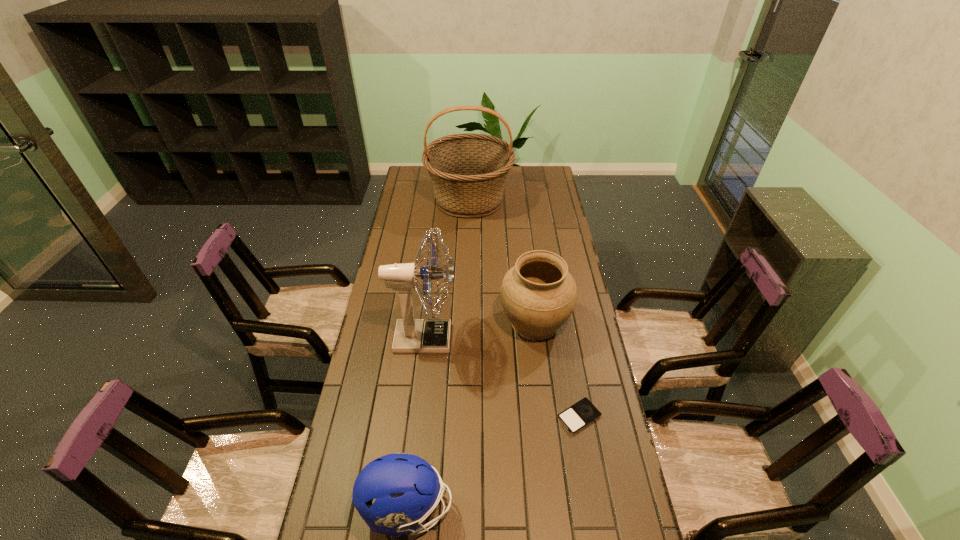
Where is `free point between the fan and the third shortest object`? This screenshot has width=960, height=540. free point between the fan and the third shortest object is located at coordinates (480, 330).

The width and height of the screenshot is (960, 540). I want to click on free area in between the fan and the fourth farthest object, so point(502,377).

Choose which object is the nearest neighbor to the fan. Please provide its 2D coordinates. Your answer should be formatted as a tuple, i.e. [(x, y)], where the tuple contains the x and y coordinates of a point satisfying the conditions above.

[(538, 294)]

Identify which object is located as the second nearest to the farthest object. Please provide its 2D coordinates. Your answer should be formatted as a tuple, i.e. [(x, y)], where the tuple contains the x and y coordinates of a point satisfying the conditions above.

[(412, 335)]

Identify the location of blank space that satisfies the following two spatial constraints: 1. on the front-facing side of the fan; 2. on the left side of the shortest object. (416, 417).

The width and height of the screenshot is (960, 540). I want to click on vacant space that satisfies the following two spatial constraints: 1. on the front-facing side of the fourth farthest object; 2. on the left side of the fan, so click(x=416, y=417).

The width and height of the screenshot is (960, 540). In order to click on vacant space that satisfies the following two spatial constraints: 1. on the front-facing side of the fan; 2. on the left side of the fourth farthest object in this screenshot , I will do `click(416, 417)`.

You are a GUI agent. You are given a task and a screenshot of the screen. Output one action in this format:
    pyautogui.click(x=<x>, y=<y>)
    Task: Click on the vacant area in the image that satisfies the following two spatial constraints: 1. on the front side of the farthest object; 2. on the right side of the shortest object
    
    Given the screenshot: What is the action you would take?
    pyautogui.click(x=463, y=417)